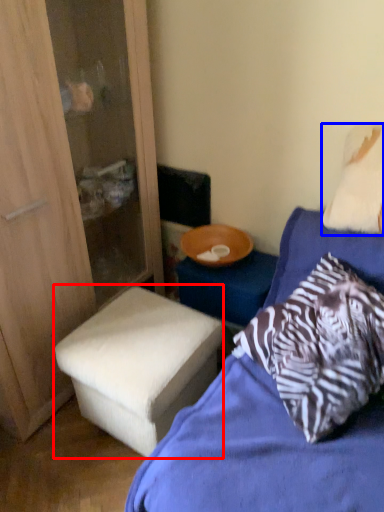
Question: Which object appears closest to the camera in this image, stool (highlighted by a red box) or pillow (highlighted by a blue box)?

Choices:
 (A) stool
 (B) pillow

Answer: (B)